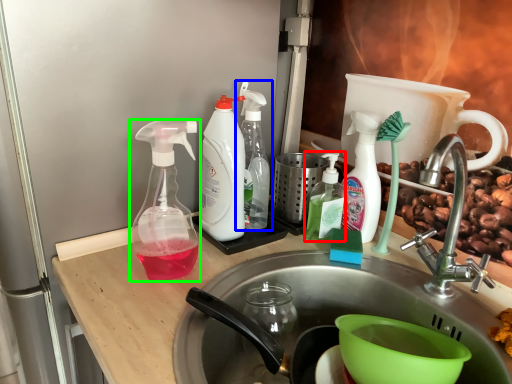
Question: Which object is the closest to the bottle (highlighted by a red box)? Choose among these: bottle (highlighted by a blue box) or bottle (highlighted by a green box).

Choices:
 (A) bottle
 (B) bottle

Answer: (A)